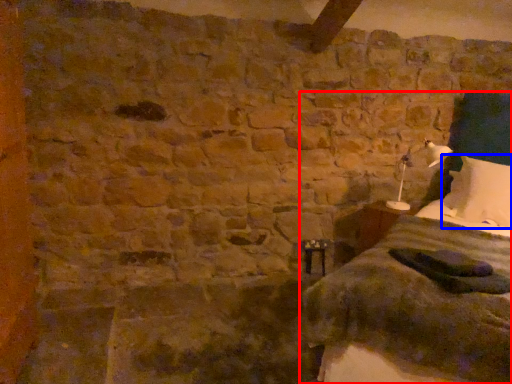
Question: Which point is closer to the camera, bed (highlighted by a red box) or pillow (highlighted by a blue box)?

Choices:
 (A) bed
 (B) pillow

Answer: (A)